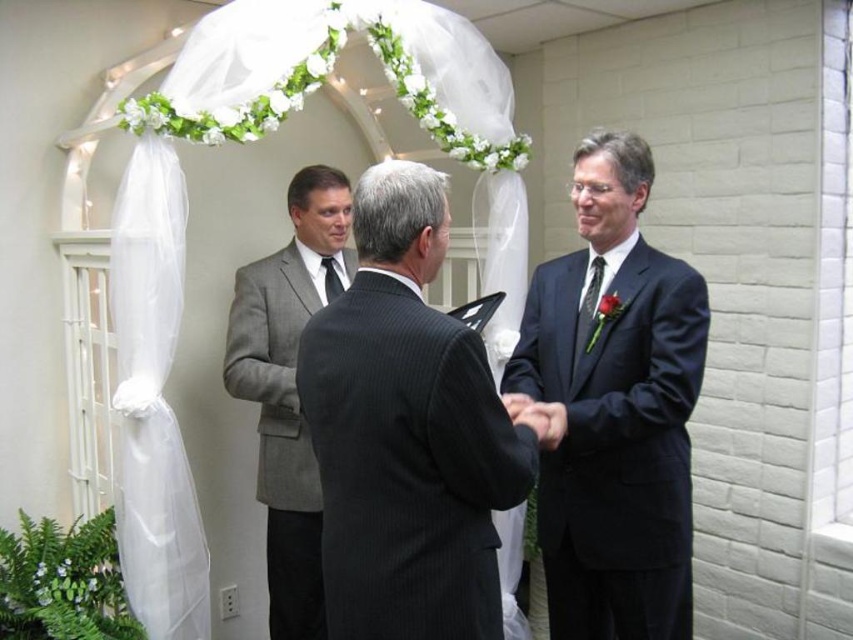
Does point (354, 492) come farther from viewer compared to point (267, 468)?

No, (354, 492) is in front of (267, 468).

Who is more forward, (366, 540) or (279, 451)?

Positioned in front is point (366, 540).

The width and height of the screenshot is (853, 640). What do you see at coordinates (407, 433) in the screenshot?
I see `dark gray pinstripe suit at center` at bounding box center [407, 433].

Find the location of a particular element. Image resolution: width=853 pixels, height=640 pixels. dark gray pinstripe suit at center is located at coordinates (407, 433).

How distant is matte black suit at right from gray textured suit at center?

33.09 inches

Does matte black suit at right appear on the left side of gray textured suit at center?

In fact, matte black suit at right is to the right of gray textured suit at center.

Does point (596, 380) come in front of point (230, 326)?

That is True.

Locate an element on the screen. matte black suit at right is located at coordinates (613, 408).

Which of these two, dark gray pinstripe suit at center or matte black suit at right, stands taller?

matte black suit at right is taller.

Does dark gray pinstripe suit at center have a larger size compared to matte black suit at right?

No.

The height and width of the screenshot is (640, 853). Describe the element at coordinates (407, 433) in the screenshot. I see `dark gray pinstripe suit at center` at that location.

You are a GUI agent. You are given a task and a screenshot of the screen. Output one action in this format:
    pyautogui.click(x=<x>, y=<y>)
    Task: Click on the dark gray pinstripe suit at center
    This screenshot has height=640, width=853.
    Given the screenshot: What is the action you would take?
    pyautogui.click(x=407, y=433)